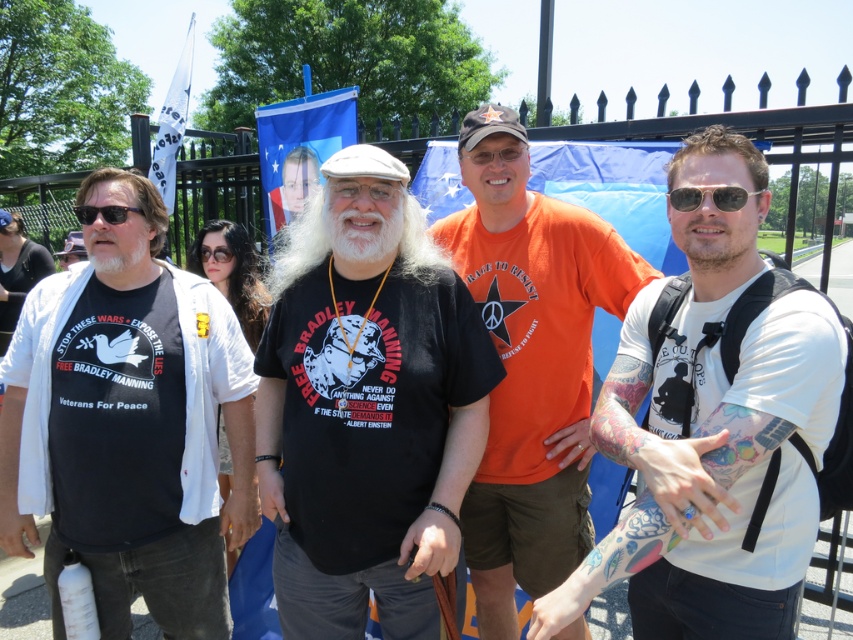
Question: Which of the following is the closest to the observer?

Choices:
 (A) black matte t-shirt at center
 (B) brown matte beard at center
 (C) orange cotton t-shirt at center
 (D) whitehairbeard at center

Answer: (B)

Question: Among these points, which one is nearest to the camera?

Choices:
 (A) (161, 474)
 (B) (720, 598)

Answer: (B)

Question: Does brown matte beard at center come behind white matte beard at center?

Choices:
 (A) yes
 (B) no

Answer: (B)

Question: Which object is farther from the camera taking this photo?

Choices:
 (A) white matte beard at center
 (B) whitehairbeard at center
 (C) brown matte beard at center
 (D) orange cotton t-shirt at center

Answer: (A)

Question: Can you confirm if white matte t-shirt at right is positioned to the right of shiny black sunglasses at right?

Choices:
 (A) no
 (B) yes

Answer: (A)

Question: Is shiny black sunglasses at right thinner than black plastic sunglasses at left?

Choices:
 (A) no
 (B) yes

Answer: (B)